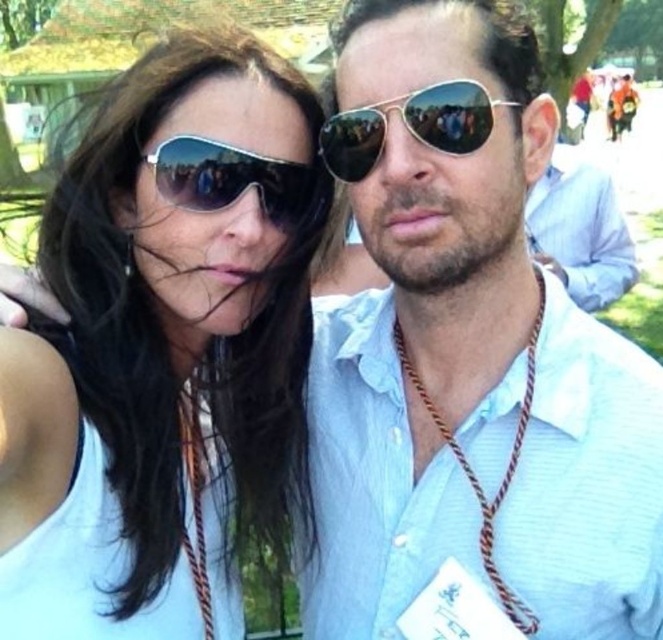
Question: Can you confirm if matte white shirt at center is positioned above matte black sunglasses at upper left?

Choices:
 (A) yes
 (B) no

Answer: (B)

Question: Does matte white shirt at center appear over matte black sunglasses at upper left?

Choices:
 (A) no
 (B) yes

Answer: (A)

Question: Can you confirm if matte black sunglasses at center is positioned above metal aviator sunglasses at center?

Choices:
 (A) no
 (B) yes

Answer: (A)

Question: Which point appears farthest from the camera in this image?

Choices:
 (A) (550, 340)
 (B) (457, 96)

Answer: (A)

Question: Which object is positioned farthest from the matte black sunglasses at upper left?

Choices:
 (A) matte black sunglasses at center
 (B) metal aviator sunglasses at center

Answer: (B)

Question: Which of the following is the farthest from the observer?

Choices:
 (A) matte black sunglasses at center
 (B) matte white shirt at center
 (C) metal aviator sunglasses at center
 (D) matte black sunglasses at upper left

Answer: (A)